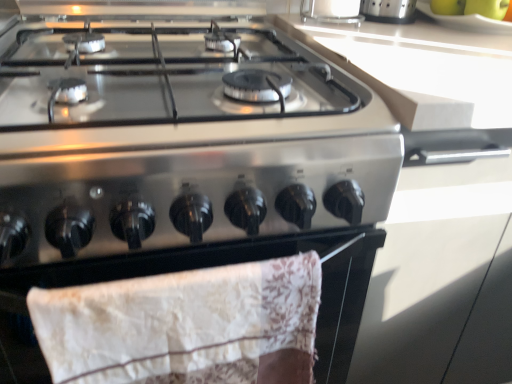
What are the coordinates of `white lace towel at lower center` in the screenshot? It's located at (200, 267).

Find the location of a particular element. clear glass container at upper center is located at coordinates (331, 11).

Where is `stainless steel gas stove at center`? stainless steel gas stove at center is located at coordinates (180, 139).

Between point (339, 383) and point (450, 9), which one is positioned behind?

The point (450, 9) is more distant.

Could you tell me if white lace towel at lower center is turned towards green matte bananas at upper right, marked as the 2th fruit in a right-to-left arrangement?

No, white lace towel at lower center is not aimed at green matte bananas at upper right, marked as the 2th fruit in a right-to-left arrangement.

In the scene shown: Between white lace towel at lower center and green matte bananas at upper right, marked as the 1th fruit in a left-to-right arrangement, which one has smaller size?

green matte bananas at upper right, marked as the 1th fruit in a left-to-right arrangement.

Is white lace towel at lower center placed right next to green matte bananas at upper right, marked as the 1th fruit in a left-to-right arrangement?

No, white lace towel at lower center is not beside green matte bananas at upper right, marked as the 1th fruit in a left-to-right arrangement.

Which object is wider, white lace towel at lower center or green matte apple at upper right, placed as the 1th fruit when sorted from right to left?

Wider between the two is green matte apple at upper right, placed as the 1th fruit when sorted from right to left.

Does point (357, 288) appear closer or farther from the camera than point (487, 13)?

Point (357, 288) appears to be closer to the viewer than point (487, 13).

Find the location of `the 1st fruit behind the white lace towel at lower center`. the 1st fruit behind the white lace towel at lower center is located at coordinates (472, 7).

Which of these two, green matte bananas at upper right, marked as the 1th fruit in a left-to-right arrangement, or stainless steel gas stove at center, stands shorter?

With less height is green matte bananas at upper right, marked as the 1th fruit in a left-to-right arrangement.

Considering the relative sizes of green matte bananas at upper right, marked as the 1th fruit in a left-to-right arrangement, and stainless steel gas stove at center in the image provided, is green matte bananas at upper right, marked as the 1th fruit in a left-to-right arrangement, wider than stainless steel gas stove at center?

In fact, green matte bananas at upper right, marked as the 1th fruit in a left-to-right arrangement, might be narrower than stainless steel gas stove at center.

Is green matte bananas at upper right, marked as the 1th fruit in a left-to-right arrangement, not close to stainless steel gas stove at center?

green matte bananas at upper right, marked as the 1th fruit in a left-to-right arrangement, is near stainless steel gas stove at center, not far away.

In the image, is green matte bananas at upper right, marked as the 2th fruit in a right-to-left arrangement, on the left side or the right side of stainless steel gas stove at center?

From the image, it's evident that green matte bananas at upper right, marked as the 2th fruit in a right-to-left arrangement, is to the right of stainless steel gas stove at center.

Considering the sizes of objects stainless steel gas stove at center and white lace towel at lower center in the image provided, who is shorter, stainless steel gas stove at center or white lace towel at lower center?

stainless steel gas stove at center.

Find the location of a particular element. The height and width of the screenshot is (384, 512). gas stove in front of the white lace towel at lower center is located at coordinates (180, 139).

Which is more to the right, stainless steel gas stove at center or white lace towel at lower center?

white lace towel at lower center.

Can you confirm if stainless steel gas stove at center is bigger than white lace towel at lower center?

Yes, stainless steel gas stove at center is bigger than white lace towel at lower center.

From the picture: Can you confirm if white lace towel at lower center is shorter than clear glass container at upper center?

Correct, white lace towel at lower center is not as tall as clear glass container at upper center.

The height and width of the screenshot is (384, 512). In the image, there is a clear glass container at upper center. Identify the location of oven below it (from a real-world perspective). (200, 267).

Which object is wider, white lace towel at lower center or clear glass container at upper center?

Wider between the two is clear glass container at upper center.

Which of these two, green matte bananas at upper right, marked as the 2th fruit in a right-to-left arrangement, or clear glass container at upper center, is bigger?

clear glass container at upper center.

Considering the relative positions of green matte bananas at upper right, marked as the 1th fruit in a left-to-right arrangement, and clear glass container at upper center in the image provided, is green matte bananas at upper right, marked as the 1th fruit in a left-to-right arrangement, to the left of clear glass container at upper center from the viewer's perspective?

Incorrect, green matte bananas at upper right, marked as the 1th fruit in a left-to-right arrangement, is not on the left side of clear glass container at upper center.

Where is `kitchen appliance that is above the green matte bananas at upper right, marked as the 2th fruit in a right-to-left arrangement (from the image's perspective)`? kitchen appliance that is above the green matte bananas at upper right, marked as the 2th fruit in a right-to-left arrangement (from the image's perspective) is located at coordinates (331, 11).

Who is shorter, green matte apple at upper right, placed as the 1th fruit when sorted from right to left, or white lace towel at lower center?

With less height is green matte apple at upper right, placed as the 1th fruit when sorted from right to left.

Considering the positions of objects green matte apple at upper right, the second fruit when ordered from left to right, and white lace towel at lower center in the image provided, who is more to the left, green matte apple at upper right, the second fruit when ordered from left to right, or white lace towel at lower center?

white lace towel at lower center is more to the left.

Is point (485, 7) positioned after point (344, 269)?

Yes, it is behind point (344, 269).

Measure the distance from green matte apple at upper right, the second fruit when ordered from left to right, to white lace towel at lower center.

green matte apple at upper right, the second fruit when ordered from left to right, is 29.28 inches from white lace towel at lower center.

From the image's perspective, starting from the white lace towel at lower center, which fruit is the 2nd one above? Please provide its 2D coordinates.

[(448, 7)]

This screenshot has height=384, width=512. In order to click on fruit that is the 2nd one when counting rightward from the white lace towel at lower center in this screenshot , I will do `click(472, 7)`.

Based on their spatial positions, is stainless steel gas stove at center or white lace towel at lower center closer to green matte apple at upper right, placed as the 1th fruit when sorted from right to left?

Among the two, stainless steel gas stove at center is located nearer to green matte apple at upper right, placed as the 1th fruit when sorted from right to left.

Which object lies further to the anchor point green matte apple at upper right, placed as the 1th fruit when sorted from right to left, clear glass container at upper center or stainless steel gas stove at center?

Based on the image, stainless steel gas stove at center appears to be further to green matte apple at upper right, placed as the 1th fruit when sorted from right to left.

When comparing their distances from white lace towel at lower center, does green matte bananas at upper right, marked as the 1th fruit in a left-to-right arrangement, or clear glass container at upper center seem further?

The object further to white lace towel at lower center is green matte bananas at upper right, marked as the 1th fruit in a left-to-right arrangement.

Looking at the image, which one is located further to green matte bananas at upper right, marked as the 2th fruit in a right-to-left arrangement, white lace towel at lower center or green matte apple at upper right, placed as the 1th fruit when sorted from right to left?

The object further to green matte bananas at upper right, marked as the 2th fruit in a right-to-left arrangement, is white lace towel at lower center.

Considering their positions, is green matte bananas at upper right, marked as the 1th fruit in a left-to-right arrangement, positioned closer to green matte apple at upper right, placed as the 1th fruit when sorted from right to left, than white lace towel at lower center?

Based on the image, green matte bananas at upper right, marked as the 1th fruit in a left-to-right arrangement, appears to be nearer to green matte apple at upper right, placed as the 1th fruit when sorted from right to left.

When comparing their distances from green matte apple at upper right, the second fruit when ordered from left to right, does green matte bananas at upper right, marked as the 2th fruit in a right-to-left arrangement, or clear glass container at upper center seem closer?

green matte bananas at upper right, marked as the 2th fruit in a right-to-left arrangement, lies closer to green matte apple at upper right, the second fruit when ordered from left to right, than the other object.

Considering their positions, is stainless steel gas stove at center positioned further to white lace towel at lower center than green matte bananas at upper right, marked as the 2th fruit in a right-to-left arrangement?

The object further to white lace towel at lower center is green matte bananas at upper right, marked as the 2th fruit in a right-to-left arrangement.

Looking at the image, which one is located closer to clear glass container at upper center, green matte apple at upper right, the second fruit when ordered from left to right, or green matte bananas at upper right, marked as the 1th fruit in a left-to-right arrangement?

green matte bananas at upper right, marked as the 1th fruit in a left-to-right arrangement.

The width and height of the screenshot is (512, 384). I want to click on fruit between green matte bananas at upper right, marked as the 1th fruit in a left-to-right arrangement, and white lace towel at lower center, in the vertical direction, so click(472, 7).

Where is `gas stove between clear glass container at upper center and white lace towel at lower center in the vertical direction`? The height and width of the screenshot is (384, 512). gas stove between clear glass container at upper center and white lace towel at lower center in the vertical direction is located at coordinates (180, 139).

Find the location of a particular element. Image resolution: width=512 pixels, height=384 pixels. fruit located between clear glass container at upper center and green matte apple at upper right, the second fruit when ordered from left to right, in the left-right direction is located at coordinates (448, 7).

Where is `fruit situated between stainless steel gas stove at center and green matte apple at upper right, placed as the 1th fruit when sorted from right to left, from left to right`? This screenshot has width=512, height=384. fruit situated between stainless steel gas stove at center and green matte apple at upper right, placed as the 1th fruit when sorted from right to left, from left to right is located at coordinates (448, 7).